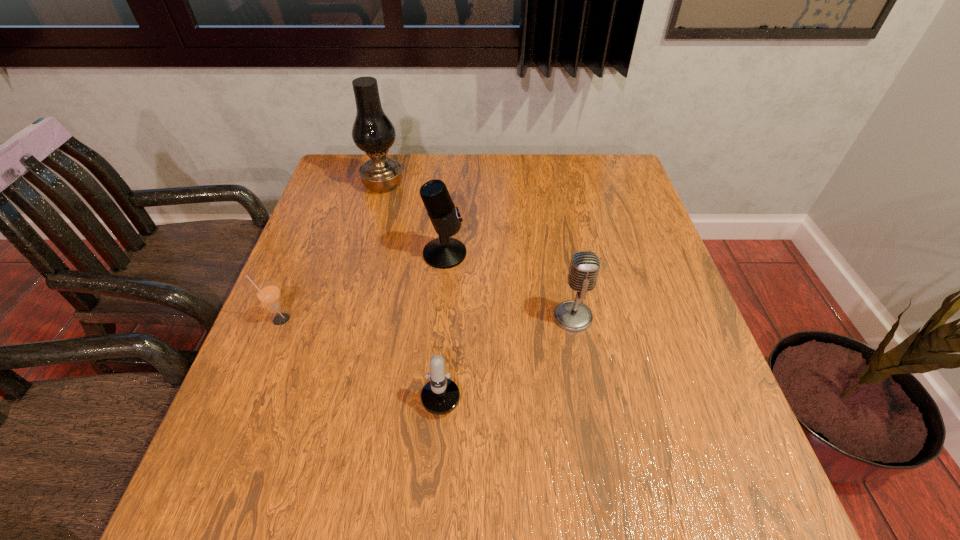
Find the location of a particular element. the farthest object is located at coordinates (373, 132).

This screenshot has height=540, width=960. Identify the location of the tallest object. (373, 132).

I want to click on the second farthest object, so click(444, 252).

The height and width of the screenshot is (540, 960). Identify the location of the second farthest microphone. (571, 315).

Identify the location of the rightmost microphone. The image size is (960, 540). (571, 315).

This screenshot has height=540, width=960. I want to click on straw, so click(x=268, y=293).

Where is `the nearest microphone`? Image resolution: width=960 pixels, height=540 pixels. the nearest microphone is located at coordinates (439, 396).

Find the location of a particular element. The height and width of the screenshot is (540, 960). the nearest object is located at coordinates (439, 396).

This screenshot has width=960, height=540. In order to click on vacant position located on the front of the oil lamp in this screenshot , I will do `click(362, 264)`.

You are a GUI agent. You are given a task and a screenshot of the screen. Output one action in this format:
    pyautogui.click(x=<x>, y=<y>)
    Task: Click on the vacant space situated on the stand of the farthest microphone
    The image size is (960, 540).
    Given the screenshot: What is the action you would take?
    pyautogui.click(x=491, y=254)